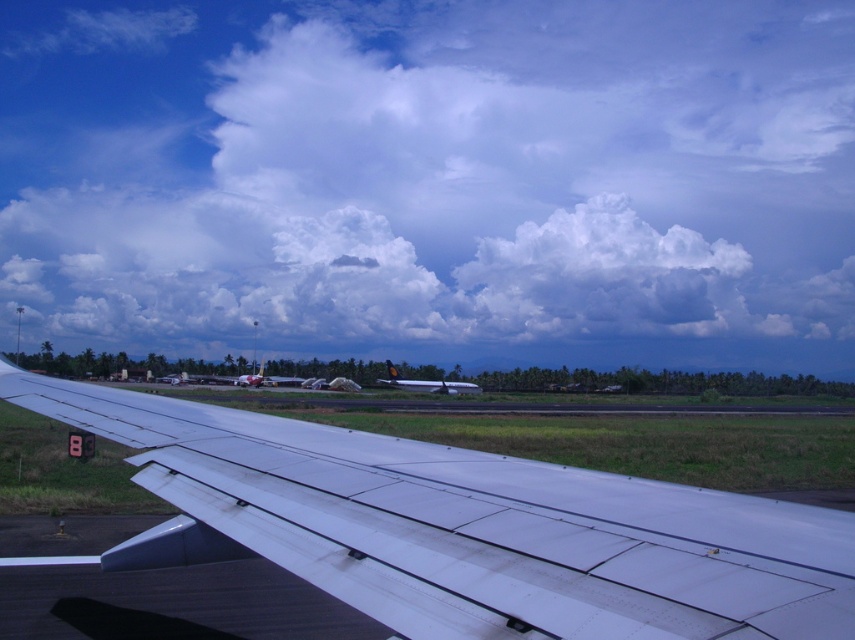
Question: Which object appears closest to the camera in this image?

Choices:
 (A) white fluffy cloud at upper center
 (B) metallic silver airplane at center

Answer: (B)

Question: Which object is farther from the camera taking this photo?

Choices:
 (A) metallic silver airplane at center
 (B) white matte wing at center
 (C) white fluffy cloud at upper center
 (D) matte white airplane at center

Answer: (C)

Question: Which of these objects is positioned closest to the metallic silver airplane at center?

Choices:
 (A) white matte wing at center
 (B) white fluffy cloud at upper center
 (C) matte white airplane at center

Answer: (C)

Question: Can you confirm if white fluffy cloud at upper center is bigger than metallic silver airplane at center?

Choices:
 (A) no
 (B) yes

Answer: (B)

Question: Can you confirm if white matte wing at center is positioned above metallic silver airplane at center?

Choices:
 (A) yes
 (B) no

Answer: (A)

Question: Is white fluffy cloud at upper center positioned in front of white matte wing at center?

Choices:
 (A) no
 (B) yes

Answer: (A)